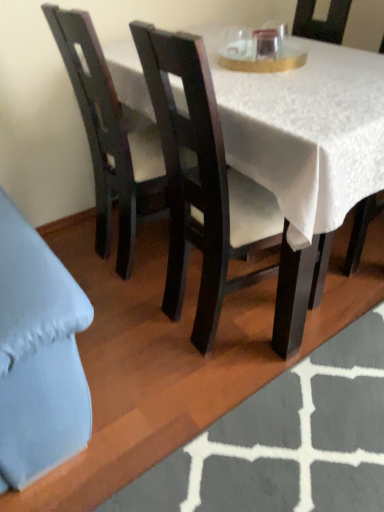
Where is `vacant space to the left of matte dark wood chair at center, which is the 2th chair in right-to-left order`? vacant space to the left of matte dark wood chair at center, which is the 2th chair in right-to-left order is located at coordinates (123, 331).